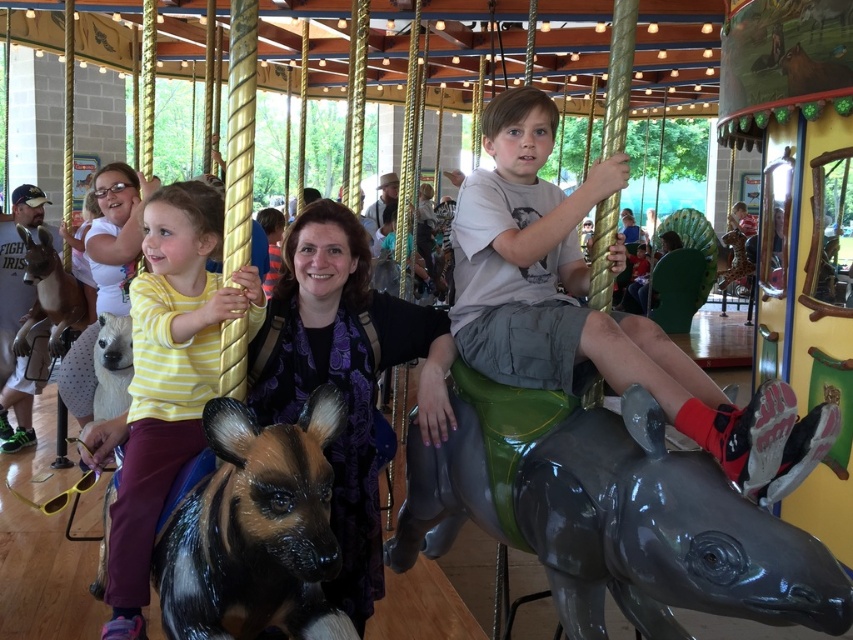
Can you confirm if shiny black horse at lower left is positioned below yellow striped shirt at left?

Yes.

Does shiny black horse at lower left have a lesser width compared to yellow striped shirt at left?

Correct, shiny black horse at lower left's width is less than yellow striped shirt at left's.

Measure the distance between point (299, 595) and camera.

Point (299, 595) is 1.76 meters from camera.

Identify the location of shiny black horse at lower left. (253, 529).

Does purple satin scarf at center have a greater height compared to yellow striped shirt at left?

Indeed, purple satin scarf at center has a greater height compared to yellow striped shirt at left.

This screenshot has width=853, height=640. Describe the element at coordinates (345, 376) in the screenshot. I see `purple satin scarf at center` at that location.

Identify the location of purple satin scarf at center. (345, 376).

Is matte gray shorts at center wider than yellow striped shirt at left?

Yes, matte gray shorts at center is wider than yellow striped shirt at left.

Is matte gray shorts at center bigger than yellow striped shirt at left?

Indeed, matte gray shorts at center has a larger size compared to yellow striped shirt at left.

Where is `matte gray shorts at center`? This screenshot has width=853, height=640. matte gray shorts at center is located at coordinates (595, 308).